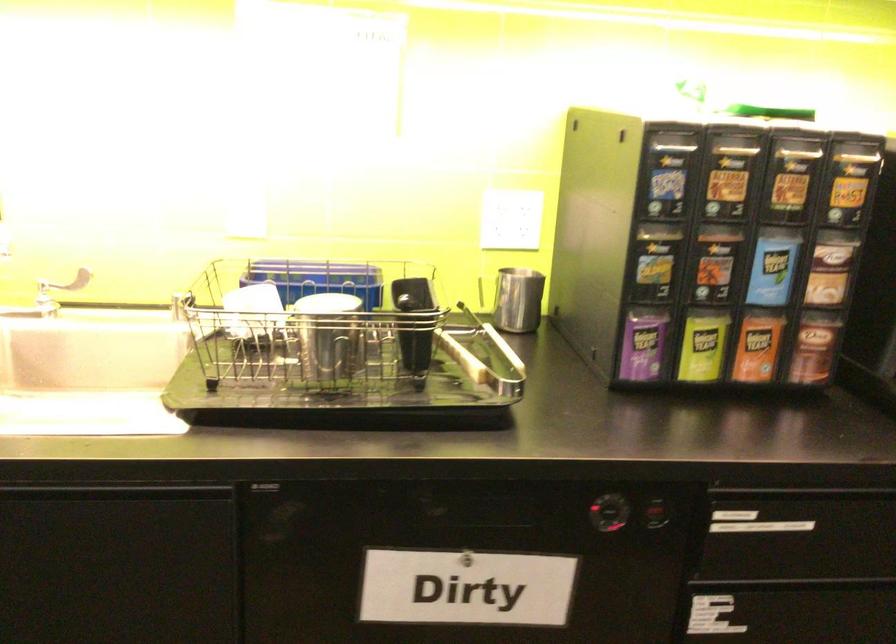
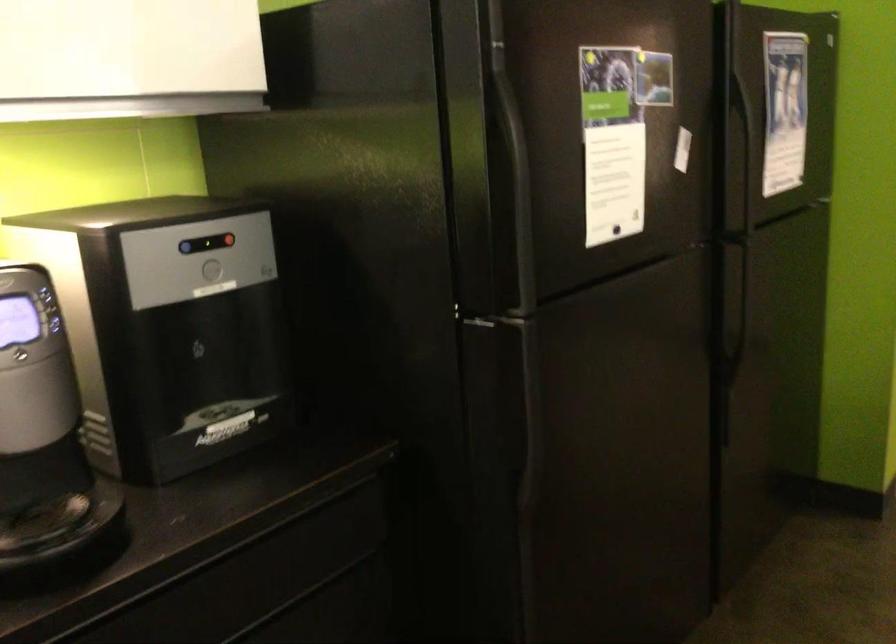
Question: The camera is either moving clockwise (left) or counter-clockwise (right) around the object. The first image is from the beginning of the video and the second image is from the end. Is the camera moving left or right when shooting the video?

Choices:
 (A) Left
 (B) Right

Answer: (A)